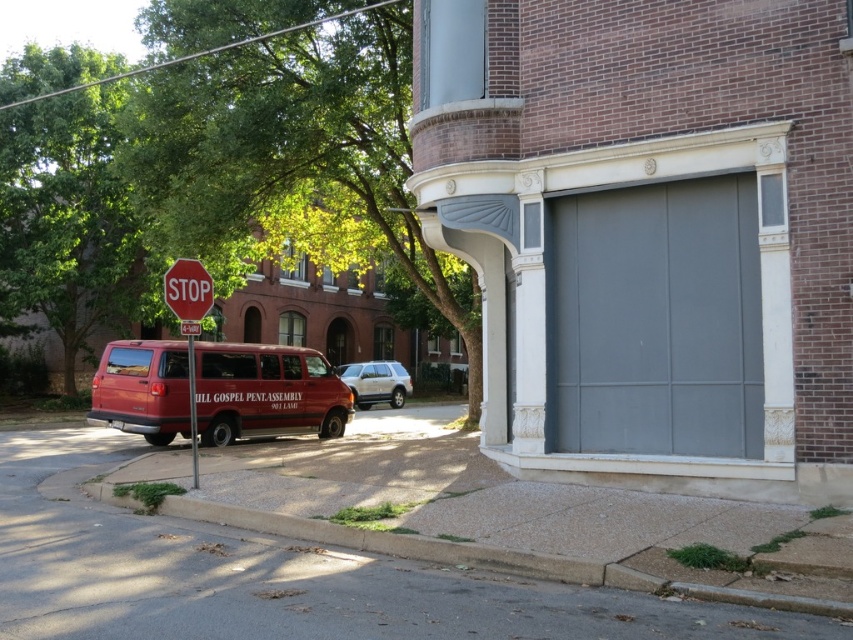
You are a photographer adjusting your camera settings to capture the urban street scene. You notice two points of interest marked at coordinates point (289, 365) and point (198, 323). Which point should you focus on first if you want to ensure both are in sharp focus?

You should focus on point (289, 365) first because it is closer to the camera than point (198, 323). This ensures the closer point is in focus, and the farther point will also be within the depth of field if properly adjusted.